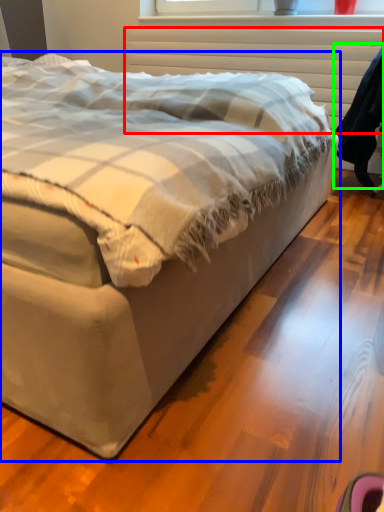
Question: Which is nearer to the radiator (highlighted by a red box)? bed (highlighted by a blue box) or robe (highlighted by a green box).

Choices:
 (A) bed
 (B) robe

Answer: (B)